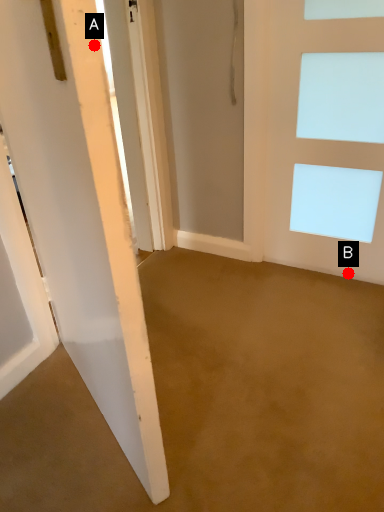
Question: Two points are circled on the image, labeled by A and B beside each circle. Which point is farther from the camera taking this photo?

Choices:
 (A) A is further
 (B) B is further

Answer: (B)